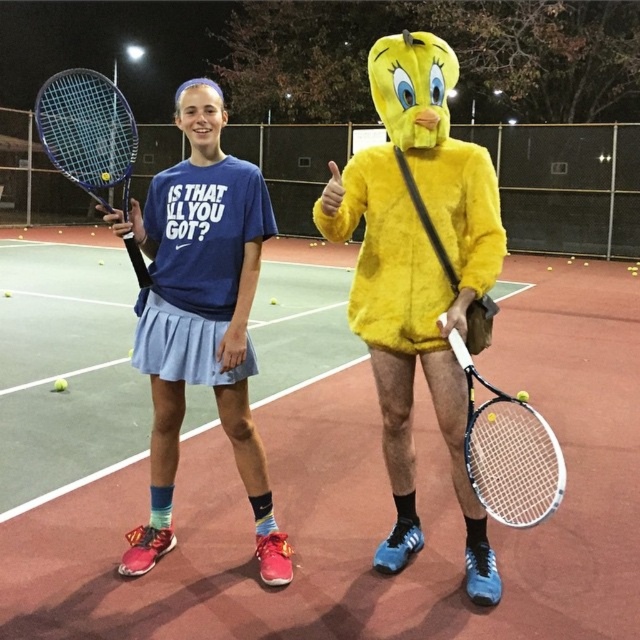
Question: Which point appears closest to the camera in this image?

Choices:
 (A) [x=278, y=563]
 (B) [x=65, y=88]
 (C) [x=477, y=380]

Answer: (C)

Question: Is white matte tennis racket at center to the left of blue matte tennis racket at left from the viewer's perspective?

Choices:
 (A) no
 (B) yes

Answer: (A)

Question: Is green synthetic turf at center thinner than blue matte tennis racket at left?

Choices:
 (A) yes
 (B) no

Answer: (A)

Question: Is matte blue skirt at center further to camera compared to white matte tennis racket at center?

Choices:
 (A) no
 (B) yes

Answer: (B)

Question: Which point appears closest to the camera in this image?

Choices:
 (A) (90, 156)
 (B) (476, 460)
 (C) (68, 234)

Answer: (B)

Question: Which of the following is the farthest from the observer?

Choices:
 (A) (552, 461)
 (B) (102, 99)
 (C) (220, 186)
 (D) (561, 280)

Answer: (D)